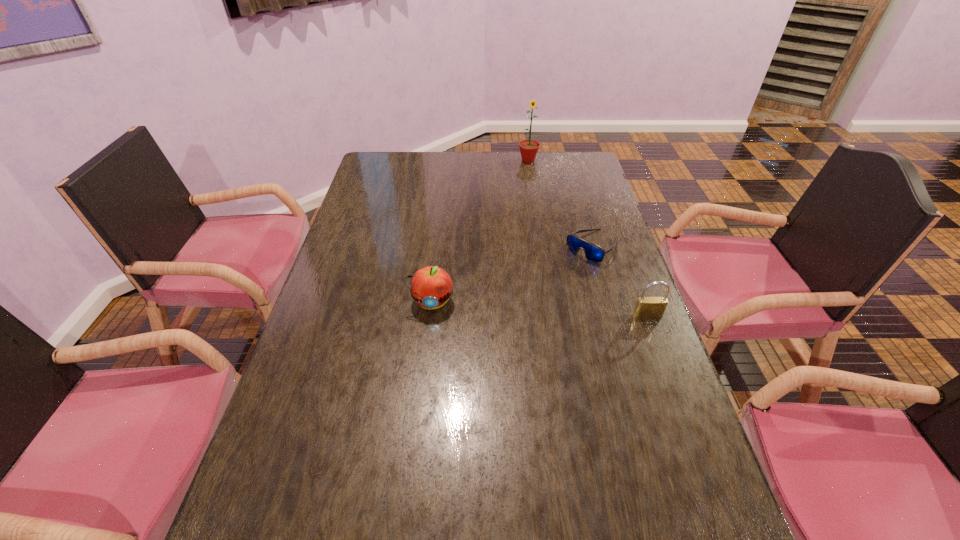
In order to click on vacant region at the far left corner in this screenshot , I will do `click(396, 181)`.

The height and width of the screenshot is (540, 960). What are the coordinates of `vacant space at the far right corner of the desktop` in the screenshot? It's located at (585, 178).

Identify the location of free space between the padlock and the sunglasses. (620, 281).

Where is `vacant space that's between the shortest object and the apple`? This screenshot has height=540, width=960. vacant space that's between the shortest object and the apple is located at coordinates (512, 274).

Identify the location of unoccupied area between the farthest object and the third nearest object. (561, 204).

At what (x,y) coordinates should I click in order to perform the action: click on vacant area that lies between the third object from right to left and the padlock. Please return your answer as a coordinate pair (x, y). Looking at the image, I should click on (588, 238).

Identify the location of vacant space in between the apple and the second object from left to right. Image resolution: width=960 pixels, height=540 pixels. (480, 231).

Identify the location of vacant space that's between the leftmost object and the shortest object. This screenshot has height=540, width=960. (512, 274).

This screenshot has height=540, width=960. In order to click on vacant space in between the second object from left to right and the leftmost object in this screenshot , I will do `click(480, 231)`.

The width and height of the screenshot is (960, 540). What are the coordinates of `free space between the apple and the shortest object` in the screenshot? It's located at (x=512, y=274).